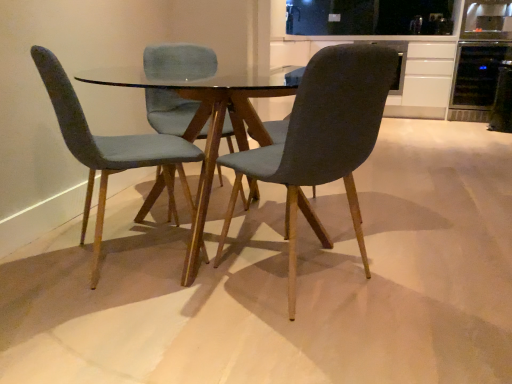
Where is `velvet teal chair at left, the 1th chair in the left-to-right sequence`? This screenshot has height=384, width=512. velvet teal chair at left, the 1th chair in the left-to-right sequence is located at coordinates (110, 149).

What is the approximate height of white matte cabinet at upper right?

36.39 inches.

Describe the element at coordinates (476, 79) in the screenshot. The height and width of the screenshot is (384, 512). I see `black glass wine cooler at upper right, positioned as the 2th appliance in front-to-back order` at that location.

At what (x,y) coordinates should I click in order to perform the action: click on black glass refrigerator at upper right, which appears as the 2th appliance when viewed from the back. Please return your answer as a coordinate pair (x, y). Looking at the image, I should click on (502, 100).

Locate an element on the screen. velvet teal chair at left, arranged as the 2th chair when viewed from the right is located at coordinates (110, 149).

Between black glass refrigerator at upper right, which appears as the 2th appliance when viewed from the back, and velvet teal chair at left, arranged as the 2th chair when viewed from the right, which one has larger size?

With larger size is velvet teal chair at left, arranged as the 2th chair when viewed from the right.

Is point (496, 93) positioned behind point (111, 160)?

Yes, it is.

Is black glass refrigerator at upper right, marked as the first appliance in a front-to-back arrangement, positioned beyond the bounds of velvet teal chair at left, arranged as the 2th chair when viewed from the right?

Absolutely, black glass refrigerator at upper right, marked as the first appliance in a front-to-back arrangement, is external to velvet teal chair at left, arranged as the 2th chair when viewed from the right.

Is transparent glass table at center surrounding black glass wine cooler at upper right, the 1th appliance from the back?

No, black glass wine cooler at upper right, the 1th appliance from the back, is not surrounded by transparent glass table at center.

Which object is further away from the camera, transparent glass table at center or black glass wine cooler at upper right, positioned as the 2th appliance in front-to-back order?

black glass wine cooler at upper right, positioned as the 2th appliance in front-to-back order, is more distant.

Is transparent glass table at center facing away from black glass wine cooler at upper right, the 1th appliance from the back?

No.

Image resolution: width=512 pixels, height=384 pixels. In order to click on coffee table located on the left of black glass wine cooler at upper right, positioned as the 2th appliance in front-to-back order in this screenshot , I will do `click(211, 120)`.

Does velvet teal chair at left, the 1th chair in the left-to-right sequence, appear on the left side of black glass refrigerator at upper right, marked as the first appliance in a front-to-back arrangement?

Correct, you'll find velvet teal chair at left, the 1th chair in the left-to-right sequence, to the left of black glass refrigerator at upper right, marked as the first appliance in a front-to-back arrangement.

From the image's perspective, which is below, velvet teal chair at left, arranged as the 2th chair when viewed from the right, or black glass refrigerator at upper right, marked as the first appliance in a front-to-back arrangement?

velvet teal chair at left, arranged as the 2th chair when viewed from the right.

Does velvet teal chair at left, arranged as the 2th chair when viewed from the right, lie behind black glass refrigerator at upper right, marked as the first appliance in a front-to-back arrangement?

That is False.

Does point (509, 83) come closer to viewer compared to point (97, 70)?

No, it is behind (97, 70).

Who is taller, black glass refrigerator at upper right, marked as the first appliance in a front-to-back arrangement, or transparent glass table at center?

Standing taller between the two is transparent glass table at center.

Is black glass refrigerator at upper right, which appears as the 2th appliance when viewed from the back, to the right of transparent glass table at center from the viewer's perspective?

Yes.

Which point is more forward, (494, 53) or (382, 89)?

The point (382, 89) is closer.

Between black glass wine cooler at upper right, positioned as the 2th appliance in front-to-back order, and dark gray fabric chair at center, which is counted as the second chair, starting from the left, which one has larger width?

black glass wine cooler at upper right, positioned as the 2th appliance in front-to-back order.

Considering the sizes of objects black glass wine cooler at upper right, positioned as the 2th appliance in front-to-back order, and dark gray fabric chair at center, acting as the 1th chair starting from the right, in the image provided, who is bigger, black glass wine cooler at upper right, positioned as the 2th appliance in front-to-back order, or dark gray fabric chair at center, acting as the 1th chair starting from the right,?

black glass wine cooler at upper right, positioned as the 2th appliance in front-to-back order, is bigger.

Which object is further away from the camera taking this photo, black glass wine cooler at upper right, positioned as the 2th appliance in front-to-back order, or dark gray fabric chair at center, acting as the 1th chair starting from the right?

black glass wine cooler at upper right, positioned as the 2th appliance in front-to-back order, is more distant.

Is dark gray fabric chair at center, which is counted as the second chair, starting from the left, beside white matte cabinet at upper right?

No, dark gray fabric chair at center, which is counted as the second chair, starting from the left, is not making contact with white matte cabinet at upper right.

Consider the image. Is dark gray fabric chair at center, which is counted as the second chair, starting from the left, bigger than white matte cabinet at upper right?

No, dark gray fabric chair at center, which is counted as the second chair, starting from the left, is not bigger than white matte cabinet at upper right.

Could you measure the distance between dark gray fabric chair at center, which is counted as the second chair, starting from the left, and white matte cabinet at upper right?

The distance of dark gray fabric chair at center, which is counted as the second chair, starting from the left, from white matte cabinet at upper right is 4.23 meters.

In the image, is dark gray fabric chair at center, acting as the 1th chair starting from the right, positioned in front of or behind white matte cabinet at upper right?

Visually, dark gray fabric chair at center, acting as the 1th chair starting from the right, is located in front of white matte cabinet at upper right.

Considering the sizes of objects transparent glass table at center and dark gray fabric chair at center, acting as the 1th chair starting from the right, in the image provided, who is taller, transparent glass table at center or dark gray fabric chair at center, acting as the 1th chair starting from the right,?

dark gray fabric chair at center, acting as the 1th chair starting from the right, is taller.

Is point (137, 220) positioned after point (231, 198)?

No.

Is transparent glass table at center positioned far away from dark gray fabric chair at center, which is counted as the second chair, starting from the left?

transparent glass table at center is near dark gray fabric chair at center, which is counted as the second chair, starting from the left, not far away.

The image size is (512, 384). Identify the location of the 2nd appliance directly beneath the velvet teal chair at left, the 1th chair in the left-to-right sequence (from a real-world perspective). (502, 100).

Find the location of a particular element. appliance above the transparent glass table at center (from a real-world perspective) is located at coordinates (476, 79).

Considering their positions, is black glass wine cooler at upper right, positioned as the 2th appliance in front-to-back order, positioned closer to black glass refrigerator at upper right, marked as the first appliance in a front-to-back arrangement, than velvet teal chair at left, arranged as the 2th chair when viewed from the right?

Among the two, black glass wine cooler at upper right, positioned as the 2th appliance in front-to-back order, is located nearer to black glass refrigerator at upper right, marked as the first appliance in a front-to-back arrangement.

When comparing their distances from dark gray fabric chair at center, which is counted as the second chair, starting from the left, does transparent glass table at center or black glass wine cooler at upper right, the 1th appliance from the back, seem closer?

transparent glass table at center is positioned closer to the anchor dark gray fabric chair at center, which is counted as the second chair, starting from the left.

Based on their spatial positions, is transparent glass table at center or black glass wine cooler at upper right, positioned as the 2th appliance in front-to-back order, closer to white matte cabinet at upper right?

Among the two, black glass wine cooler at upper right, positioned as the 2th appliance in front-to-back order, is located nearer to white matte cabinet at upper right.

Based on their spatial positions, is white matte cabinet at upper right or velvet teal chair at left, the 1th chair in the left-to-right sequence, further from black glass wine cooler at upper right, positioned as the 2th appliance in front-to-back order?

The object further to black glass wine cooler at upper right, positioned as the 2th appliance in front-to-back order, is velvet teal chair at left, the 1th chair in the left-to-right sequence.

Based on the photo, from the image, which object appears to be farther from white matte cabinet at upper right, dark gray fabric chair at center, acting as the 1th chair starting from the right, or black glass wine cooler at upper right, positioned as the 2th appliance in front-to-back order?

Among the two, dark gray fabric chair at center, acting as the 1th chair starting from the right, is located further to white matte cabinet at upper right.

Based on their spatial positions, is black glass refrigerator at upper right, marked as the first appliance in a front-to-back arrangement, or velvet teal chair at left, the 1th chair in the left-to-right sequence, closer to transparent glass table at center?

The object closer to transparent glass table at center is velvet teal chair at left, the 1th chair in the left-to-right sequence.

When comparing their distances from black glass wine cooler at upper right, positioned as the 2th appliance in front-to-back order, does transparent glass table at center or black glass refrigerator at upper right, which appears as the 2th appliance when viewed from the back, seem closer?

Based on the image, black glass refrigerator at upper right, which appears as the 2th appliance when viewed from the back, appears to be nearer to black glass wine cooler at upper right, positioned as the 2th appliance in front-to-back order.

Which object lies further to the anchor point velvet teal chair at left, the 1th chair in the left-to-right sequence, white matte cabinet at upper right or transparent glass table at center?

white matte cabinet at upper right is positioned further to the anchor velvet teal chair at left, the 1th chair in the left-to-right sequence.

Where is `coffee table between dark gray fabric chair at center, which is counted as the second chair, starting from the left, and white matte cabinet at upper right in the front-back direction`? The image size is (512, 384). coffee table between dark gray fabric chair at center, which is counted as the second chair, starting from the left, and white matte cabinet at upper right in the front-back direction is located at coordinates (211, 120).

You are a GUI agent. You are given a task and a screenshot of the screen. Output one action in this format:
    pyautogui.click(x=<x>, y=<y>)
    Task: Click on the coffee table between dark gray fabric chair at center, which is counted as the second chair, starting from the left, and black glass wine cooler at upper right, the 1th appliance from the back, from front to back
    This screenshot has height=384, width=512.
    Given the screenshot: What is the action you would take?
    pyautogui.click(x=211, y=120)

In order to click on chair between transparent glass table at center and black glass wine cooler at upper right, positioned as the 2th appliance in front-to-back order, from front to back in this screenshot , I will do `click(110, 149)`.

I want to click on chair between dark gray fabric chair at center, acting as the 1th chair starting from the right, and black glass refrigerator at upper right, marked as the first appliance in a front-to-back arrangement, in the front-back direction, so click(110, 149).